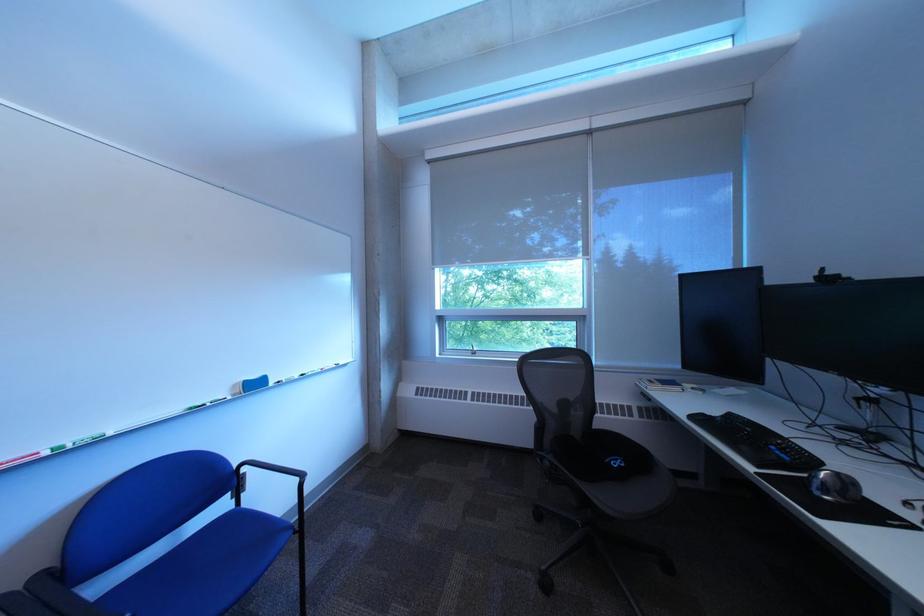
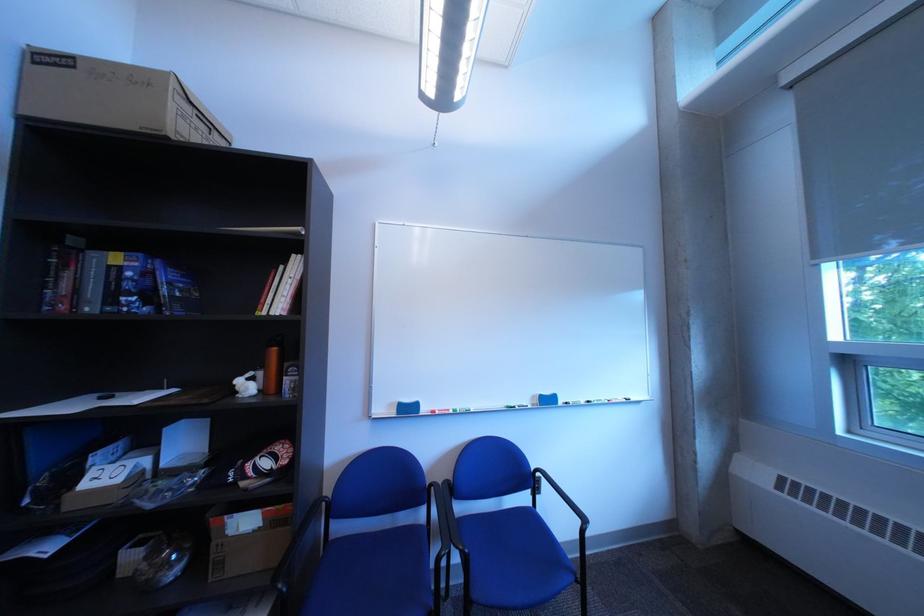
Find the pixel in the second image that matches (x=54, y=455) in the first image.

(465, 411)